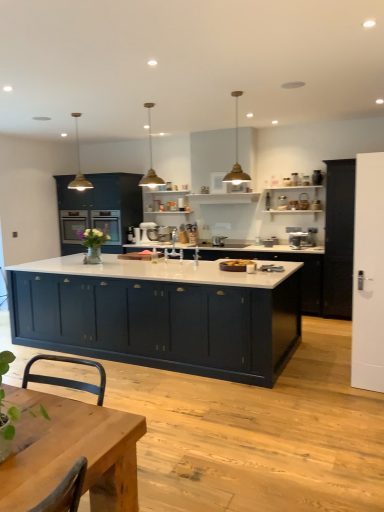
Question: Can you confirm if wooden table at center is bigger than white matte stand mixer at center, the 2th appliance when ordered from front to back?

Choices:
 (A) no
 (B) yes

Answer: (B)

Question: Considering the relative sizes of wooden table at center and white matte stand mixer at center, which appears as the 1th appliance when viewed from the left, in the image provided, is wooden table at center shorter than white matte stand mixer at center, which appears as the 1th appliance when viewed from the left,?

Choices:
 (A) no
 (B) yes

Answer: (A)

Question: Considering the relative sizes of wooden table at center and white matte stand mixer at center, which appears as the 1th appliance when viewed from the left, in the image provided, is wooden table at center smaller than white matte stand mixer at center, which appears as the 1th appliance when viewed from the left,?

Choices:
 (A) yes
 (B) no

Answer: (B)

Question: Is the position of wooden table at center more distant than that of white matte stand mixer at center, which appears as the 1th appliance when viewed from the left?

Choices:
 (A) yes
 (B) no

Answer: (B)

Question: From a real-world perspective, is wooden table at center below white matte stand mixer at center, which appears as the 1th appliance when viewed from the left?

Choices:
 (A) yes
 (B) no

Answer: (A)

Question: From the image's perspective, is green leafy plant at lower left located above or below satin silver mixer at center, which ranks as the first appliance in right-to-left order?

Choices:
 (A) below
 (B) above

Answer: (A)

Question: From a real-world perspective, is green leafy plant at lower left positioned above or below satin silver mixer at center, which is the second appliance from left to right?

Choices:
 (A) above
 (B) below

Answer: (B)

Question: Is green leafy plant at lower left bigger or smaller than satin silver mixer at center, which is the 1th appliance from front to back?

Choices:
 (A) small
 (B) big

Answer: (B)

Question: Is green leafy plant at lower left to the left or to the right of satin silver mixer at center, which ranks as the first appliance in right-to-left order, in the image?

Choices:
 (A) right
 (B) left

Answer: (B)

Question: Looking at the image, does wooden table at center seem bigger or smaller compared to white matte stand mixer at center, which is the 2th appliance in right-to-left order?

Choices:
 (A) small
 (B) big

Answer: (B)

Question: Is wooden table at center inside or outside of white matte stand mixer at center, the 2th appliance when ordered from front to back?

Choices:
 (A) inside
 (B) outside

Answer: (B)

Question: From the image's perspective, is wooden table at center positioned above or below white matte stand mixer at center, which is the 2th appliance in right-to-left order?

Choices:
 (A) below
 (B) above

Answer: (A)

Question: Is wooden table at center taller or shorter than white matte stand mixer at center, which appears as the 1th appliance when viewed from the left?

Choices:
 (A) tall
 (B) short

Answer: (A)

Question: Does point (150, 224) appear closer or farther from the camera than point (155, 228)?

Choices:
 (A) closer
 (B) farther

Answer: (B)

Question: Looking at the image, does white matte stand mixer at center, the 2th appliance when ordered from front to back, seem bigger or smaller compared to satin silver mixer at center, the second appliance in the back-to-front sequence?

Choices:
 (A) small
 (B) big

Answer: (A)